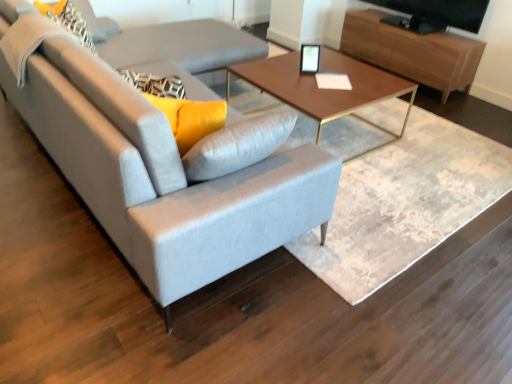
Question: Can you confirm if light gray fabric couch at center is shorter than black glossy tv at upper right?

Choices:
 (A) yes
 (B) no

Answer: (B)

Question: Is light gray fabric couch at center not within black glossy tv at upper right?

Choices:
 (A) yes
 (B) no

Answer: (A)

Question: Is the depth of light gray fabric couch at center less than that of black glossy tv at upper right?

Choices:
 (A) yes
 (B) no

Answer: (A)

Question: Is light gray fabric couch at center not close to black glossy tv at upper right?

Choices:
 (A) no
 (B) yes

Answer: (B)

Question: Can black glossy tv at upper right be found inside light gray fabric couch at center?

Choices:
 (A) no
 (B) yes

Answer: (A)

Question: Looking at their shapes, would you say wooden entertainment center at upper right is wider or thinner than black glossy tv at upper right?

Choices:
 (A) wide
 (B) thin

Answer: (A)

Question: Considering the positions of point (459, 39) and point (436, 28), is point (459, 39) closer or farther from the camera than point (436, 28)?

Choices:
 (A) closer
 (B) farther

Answer: (A)

Question: From the image's perspective, is wooden entertainment center at upper right located above or below black glossy tv at upper right?

Choices:
 (A) above
 (B) below

Answer: (B)

Question: Would you say wooden entertainment center at upper right is to the left or to the right of black glossy tv at upper right in the picture?

Choices:
 (A) left
 (B) right

Answer: (A)

Question: Is light gray fabric couch at center in front of or behind wooden entertainment center at upper right in the image?

Choices:
 (A) behind
 (B) front

Answer: (B)

Question: From the image's perspective, relative to wooden entertainment center at upper right, is light gray fabric couch at center above or below?

Choices:
 (A) below
 (B) above

Answer: (A)

Question: In terms of height, does light gray fabric couch at center look taller or shorter compared to wooden entertainment center at upper right?

Choices:
 (A) short
 (B) tall

Answer: (B)

Question: Looking at their shapes, would you say light gray fabric couch at center is wider or thinner than wooden entertainment center at upper right?

Choices:
 (A) thin
 (B) wide

Answer: (B)

Question: Relative to light gray fabric couch at center, is matte black picture frame at center in front or behind?

Choices:
 (A) front
 (B) behind

Answer: (B)

Question: Considering the positions of matte black picture frame at center and light gray fabric couch at center in the image, is matte black picture frame at center taller or shorter than light gray fabric couch at center?

Choices:
 (A) tall
 (B) short

Answer: (B)